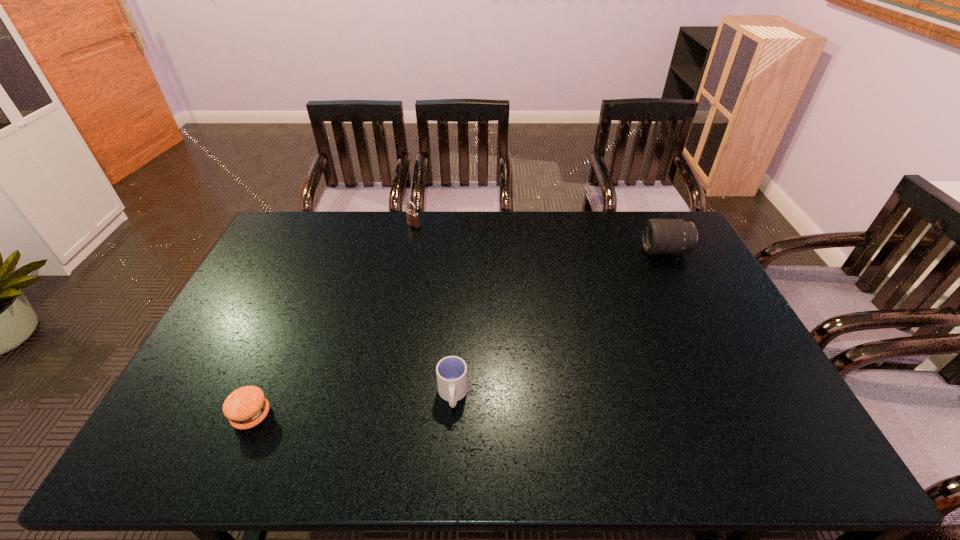
I want to click on the rightmost object, so click(x=660, y=236).

The image size is (960, 540). Find the location of `telephoto lens`. telephoto lens is located at coordinates (660, 236).

At what (x,y) coordinates should I click in order to perform the action: click on the third object from right to left. Please return your answer as a coordinate pair (x, y). The width and height of the screenshot is (960, 540). Looking at the image, I should click on (412, 216).

Where is `padlock`? The image size is (960, 540). padlock is located at coordinates (412, 216).

What are the coordinates of `the second shortest object` in the screenshot? It's located at (451, 371).

You are a GUI agent. You are given a task and a screenshot of the screen. Output one action in this format:
    pyautogui.click(x=<x>, y=<y>)
    Task: Click on the third object from left to right
    The width and height of the screenshot is (960, 540).
    Given the screenshot: What is the action you would take?
    pyautogui.click(x=451, y=371)

Image resolution: width=960 pixels, height=540 pixels. Identify the location of patty. (246, 407).

Locate an element on the screen. Image resolution: width=960 pixels, height=540 pixels. the leftmost object is located at coordinates (246, 407).

Image resolution: width=960 pixels, height=540 pixels. Find the location of `vacant position located on the surface of the rightmost object`. vacant position located on the surface of the rightmost object is located at coordinates (592, 251).

At what (x,y) coordinates should I click in order to perform the action: click on free space located 0.050m on the surface of the rightmost object. Please return your answer as a coordinate pair (x, y). This screenshot has height=540, width=960. Looking at the image, I should click on (629, 251).